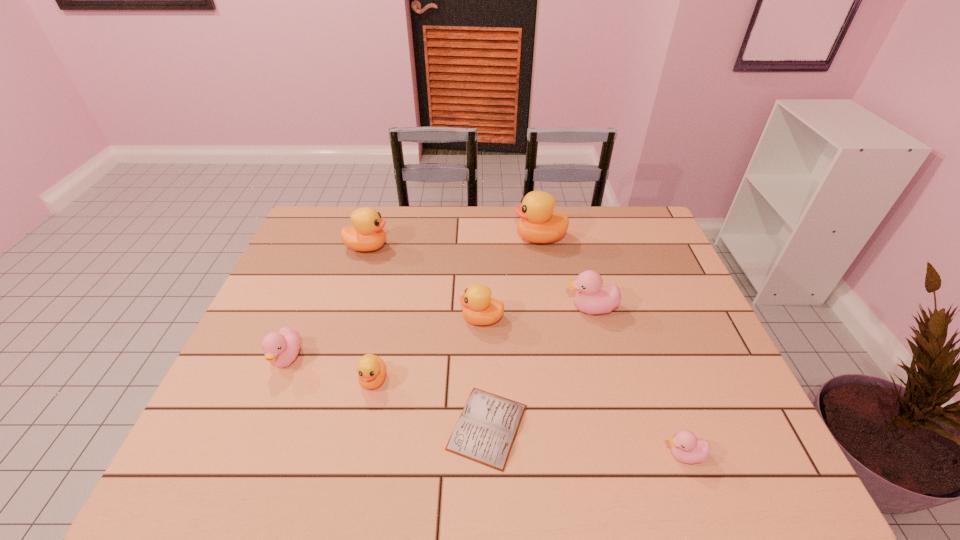
Locate an element on the screen. vacant region located on the front-facing side of the biggest pink duckling is located at coordinates (540, 308).

Where is `free space located on the front-facing side of the biggest pink duckling`? free space located on the front-facing side of the biggest pink duckling is located at coordinates (518, 308).

In order to click on vacant region located 0.350m on the face of the fourth duckling from left to right in this screenshot , I will do `click(334, 319)`.

Find the location of a particular element. The height and width of the screenshot is (540, 960). vacant area situated on the face of the fourth duckling from left to right is located at coordinates (402, 319).

At what (x,y) coordinates should I click in order to perform the action: click on free space located 0.370m on the face of the fourth duckling from left to right. Please return your answer as a coordinate pair (x, y). Looking at the image, I should click on (326, 319).

You are a GUI agent. You are given a task and a screenshot of the screen. Output one action in this format:
    pyautogui.click(x=<x>, y=<y>)
    Task: Click on the vacant position located on the front-facing side of the second biggest pink duckling
    This screenshot has height=540, width=960.
    Given the screenshot: What is the action you would take?
    pyautogui.click(x=245, y=463)

Where is `vacant space located on the face of the nearest yellow duckling`? This screenshot has width=960, height=540. vacant space located on the face of the nearest yellow duckling is located at coordinates (361, 435).

This screenshot has height=540, width=960. I want to click on free region located on the front-facing side of the smallest pink duckling, so click(530, 456).

Locate an element on the screen. This screenshot has height=540, width=960. vacant area situated on the front-facing side of the smallest pink duckling is located at coordinates (488, 456).

Locate an element on the screen. The width and height of the screenshot is (960, 540). vacant space located on the front-facing side of the smallest pink duckling is located at coordinates (506, 456).